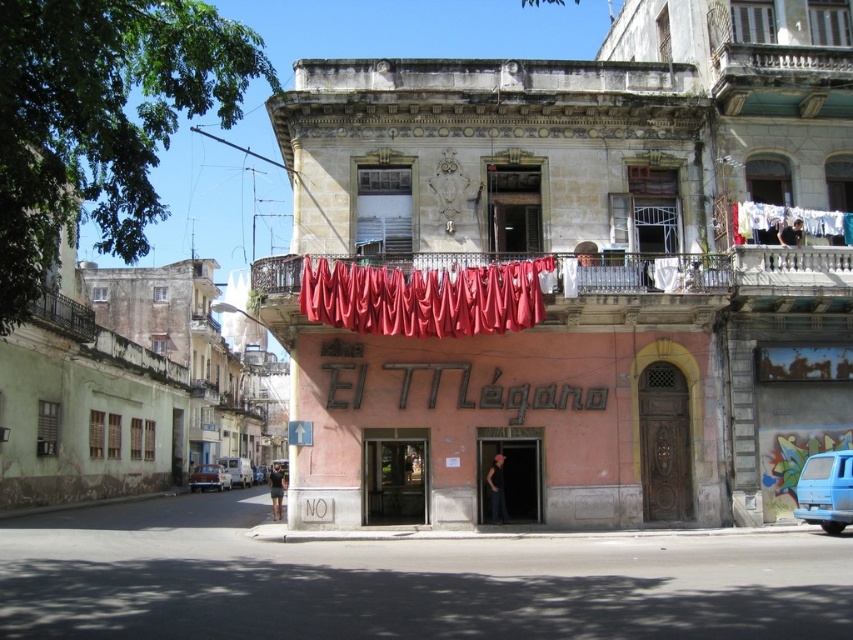
Who is positioned more to the left, shiny red fabric at center or rustic metal balcony at upper left?

Positioned to the left is rustic metal balcony at upper left.

Is shiny red fabric at center in front of rustic metal balcony at upper left?

No.

The image size is (853, 640). Find the location of `shiny red fabric at center`. shiny red fabric at center is located at coordinates (424, 298).

In the scene shown: Is white matte van at lower left wider than metallic silver van at center?

Correct, the width of white matte van at lower left exceeds that of metallic silver van at center.

Measure the distance from white matte van at lower left to metallic silver van at center.

11.21 meters

Identify the location of white matte van at lower left. This screenshot has width=853, height=640. (236, 470).

Between blue matte van at lower right and rustic metal balcony at upper left, which one appears on the right side from the viewer's perspective?

blue matte van at lower right

Does blue matte van at lower right appear on the right side of rustic metal balcony at upper left?

Yes, blue matte van at lower right is to the right of rustic metal balcony at upper left.

Who is more forward, (827, 488) or (84, 307)?

Point (827, 488)

Locate an element on the screen. blue matte van at lower right is located at coordinates (825, 490).